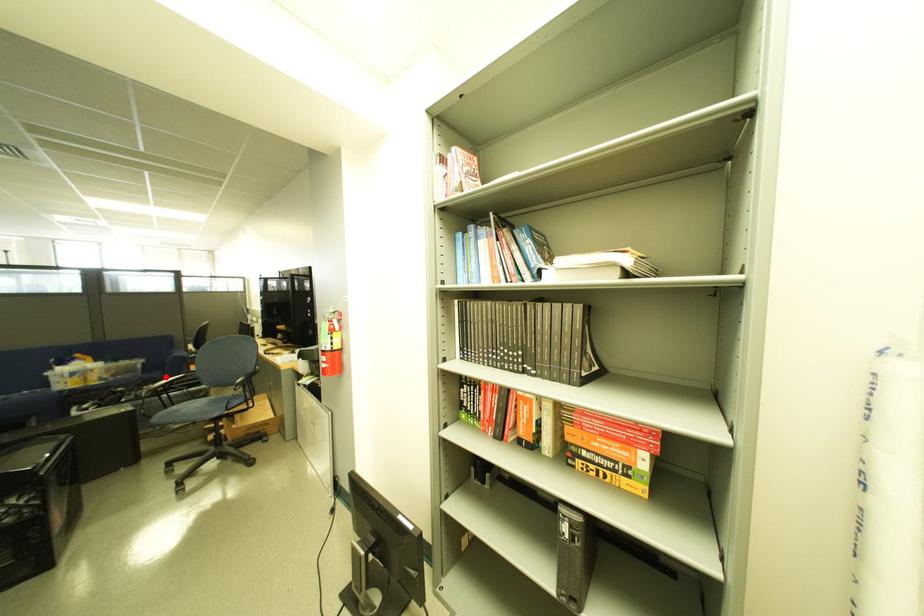
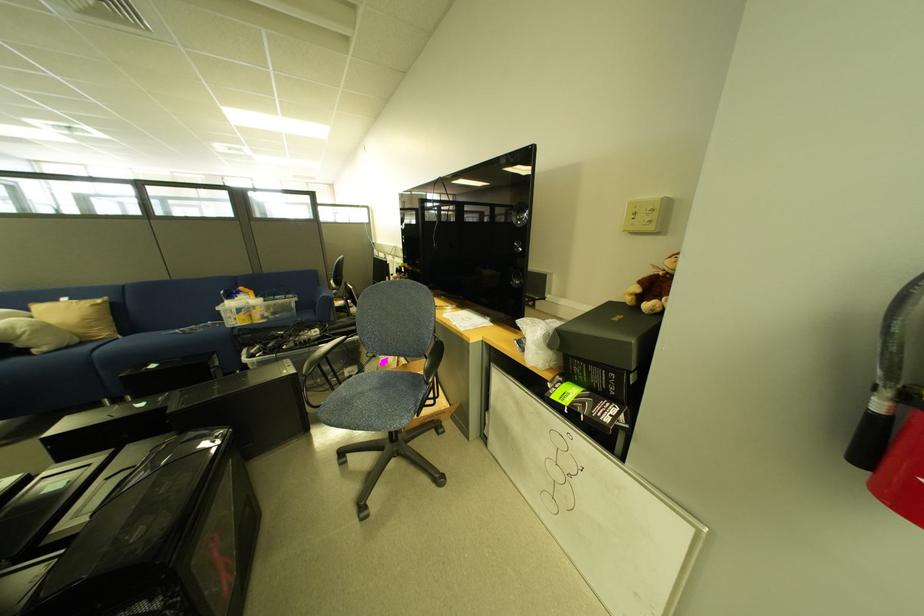
Question: I am providing you with two images of the same scene from different viewpoints. Image1 has a red point marked. In image2, the corresponding 3D location appears at what relative position? Reply with the corresponding letter.

Choices:
 (A) Closer
 (B) Farther

Answer: (A)